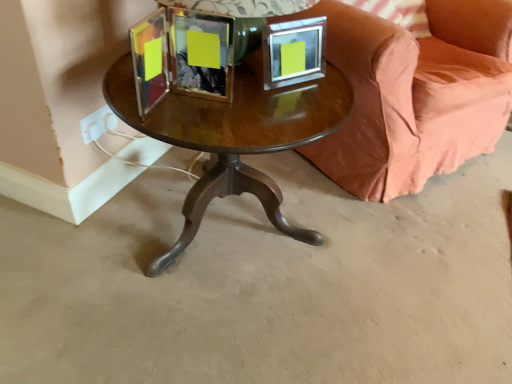
Question: Is point (311, 54) positioned closer to the camera than point (228, 129)?

Choices:
 (A) farther
 (B) closer

Answer: (A)

Question: In the image, is metallic silver picture frame at upper center on the left side or the right side of shiny brown wood coffee table at center?

Choices:
 (A) right
 (B) left

Answer: (A)

Question: Estimate the real-world distances between objects in this image. Which object is closer to the brown polished wood table at center?

Choices:
 (A) metallic silver picture frame at upper center
 (B) pink fabric pillow at upper right
 (C) velvet coral couch at center
 (D) shiny brown wood coffee table at center

Answer: (C)

Question: Estimate the real-world distances between objects in this image. Which object is closer to the pink fabric pillow at upper right?

Choices:
 (A) brown polished wood table at center
 (B) velvet coral couch at center
 (C) shiny brown wood coffee table at center
 (D) metallic silver picture frame at upper center

Answer: (B)